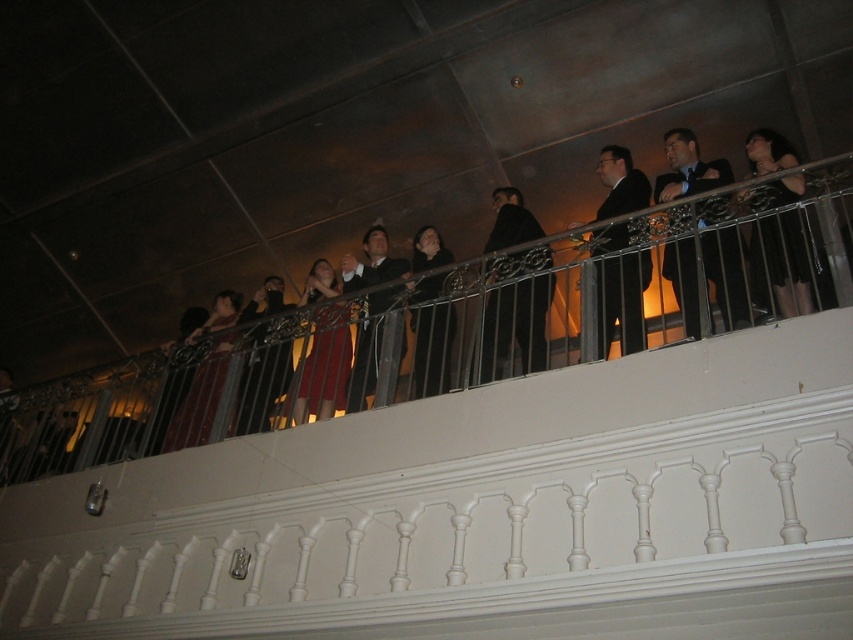
Is black satin dress at upper right thinner than shiny red dress at center?

Yes, black satin dress at upper right is thinner than shiny red dress at center.

Can you confirm if black satin dress at upper right is taller than shiny red dress at center?

Incorrect, black satin dress at upper right's height is not larger of shiny red dress at center's.

Where is `black satin dress at upper right`? black satin dress at upper right is located at coordinates (784, 260).

Where is `black satin dress at upper right`? This screenshot has width=853, height=640. black satin dress at upper right is located at coordinates (784, 260).

Does shiny red dress at center have a greater width compared to matte black coat at center?

Indeed, shiny red dress at center has a greater width compared to matte black coat at center.

Find the location of a particular element. This screenshot has height=640, width=853. shiny red dress at center is located at coordinates (325, 365).

Between matte black robe at center and velvet red dress at center, which one is positioned lower?

velvet red dress at center is lower down.

Is matte black robe at center closer to the viewer compared to velvet red dress at center?

Yes.

What do you see at coordinates (262, 380) in the screenshot?
I see `matte black robe at center` at bounding box center [262, 380].

Where is `matte black robe at center`? matte black robe at center is located at coordinates (262, 380).